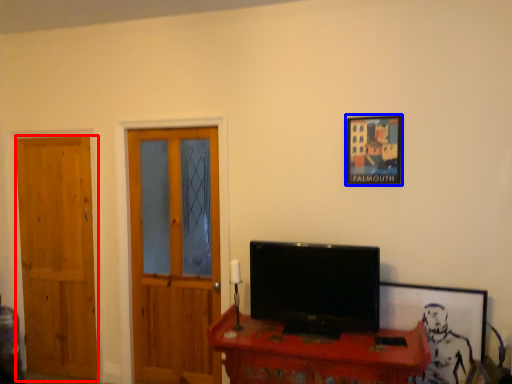
Question: Which object appears closest to the camera in this image, door (highlighted by a red box) or picture frame (highlighted by a blue box)?

Choices:
 (A) door
 (B) picture frame

Answer: (B)